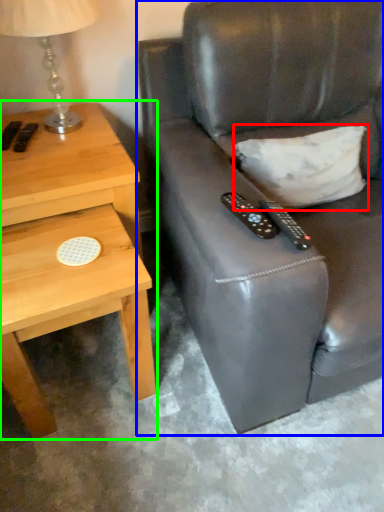
Question: Estimate the real-world distances between objects in this image. Which object is closer to pillow (highlighted by a red box), chair (highlighted by a blue box) or nightstand (highlighted by a green box)?

Choices:
 (A) chair
 (B) nightstand

Answer: (A)